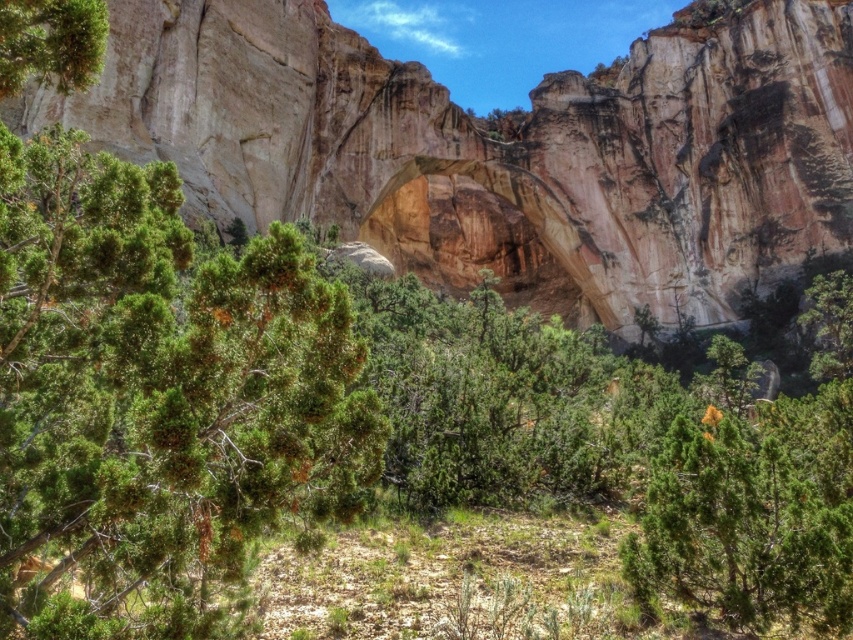
You are standing at the camera position and want to reach the point marked at coordinates (677, 424). If your walking speed is 1.5 meters per second, how many seconds will it take you to reach that point?

The distance between the point marked at coordinates (677, 424) and the camera is 70.75 meters. At a walking speed of 1.5 meters per second, it would take approximately 47.17 seconds to reach the point.